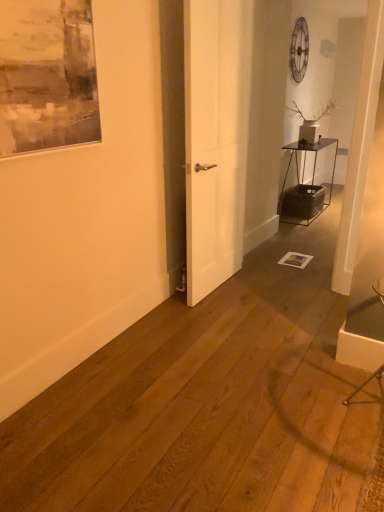
At what (x,y) coordinates should I click in order to perform the action: click on free spot to the left of metallic silver armchair at lower right. Please return your answer as a coordinate pair (x, y). The width and height of the screenshot is (384, 512). Looking at the image, I should click on (308, 391).